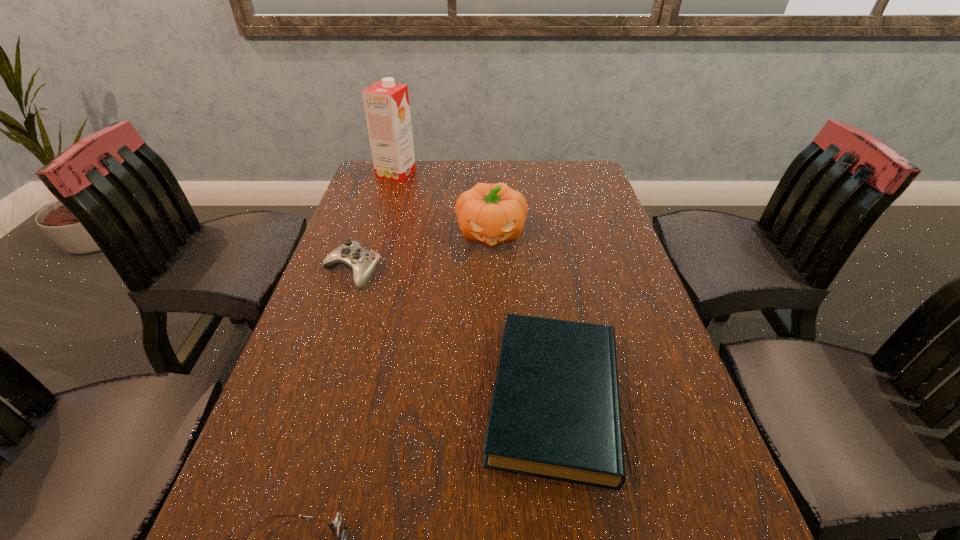
The height and width of the screenshot is (540, 960). I want to click on carton, so click(x=386, y=103).

The height and width of the screenshot is (540, 960). Find the location of `the farthest object`. the farthest object is located at coordinates (386, 103).

Find the location of a particular element. pumpkin is located at coordinates (490, 214).

I want to click on control, so click(360, 262).

The height and width of the screenshot is (540, 960). Identify the location of the second nearest object. (555, 413).

Find the location of a particular element. Image resolution: width=960 pixels, height=540 pixels. free region located on the right of the carton is located at coordinates (450, 173).

Identify the location of vacant region located 0.120m on the carved face of the fourth shortest object. (492, 286).

You are a GUI agent. You are given a task and a screenshot of the screen. Output one action in this format:
    pyautogui.click(x=<x>, y=<y>)
    Task: Click on the free space located 0.190m on the back of the control
    Image resolution: width=960 pixels, height=540 pixels.
    Given the screenshot: What is the action you would take?
    pyautogui.click(x=372, y=214)

This screenshot has width=960, height=540. Find the location of `free space located on the back of the book`. free space located on the back of the book is located at coordinates (530, 233).

At what (x,y) coordinates should I click in order to perform the action: click on object located at the far edge. Please return your answer as a coordinate pair (x, y). Looking at the image, I should click on (386, 103).